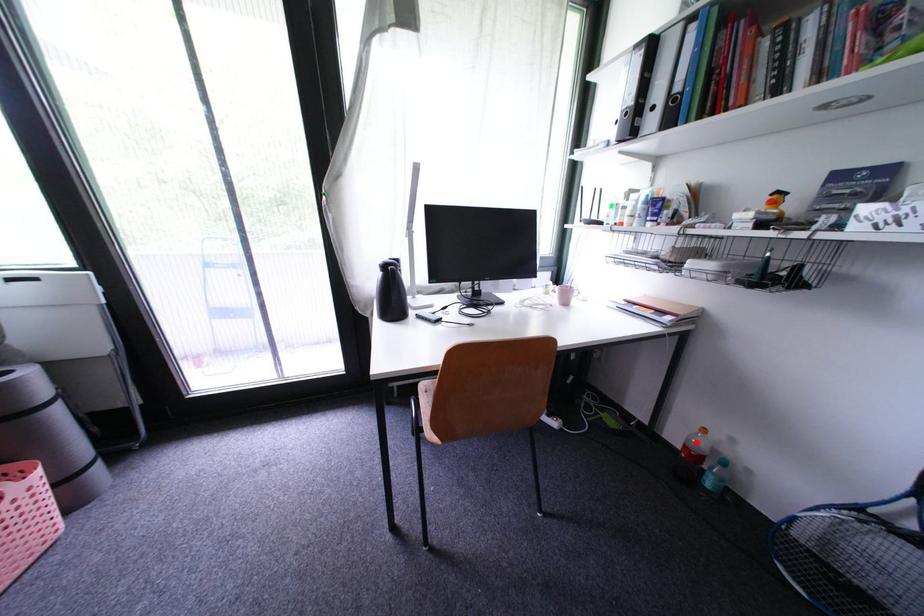
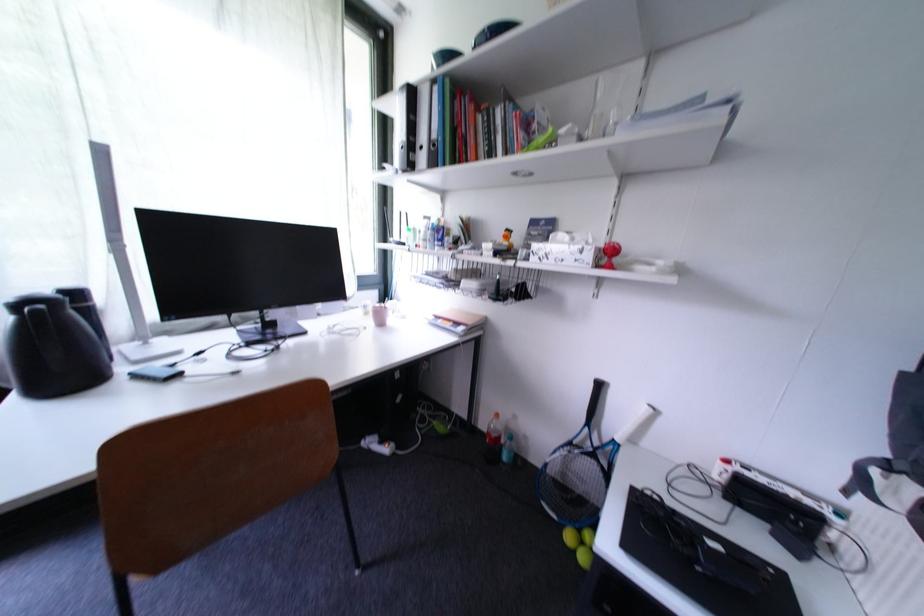
Locate, in the second image, the point that corresponds to the highlighted location in the first image.

(497, 429)